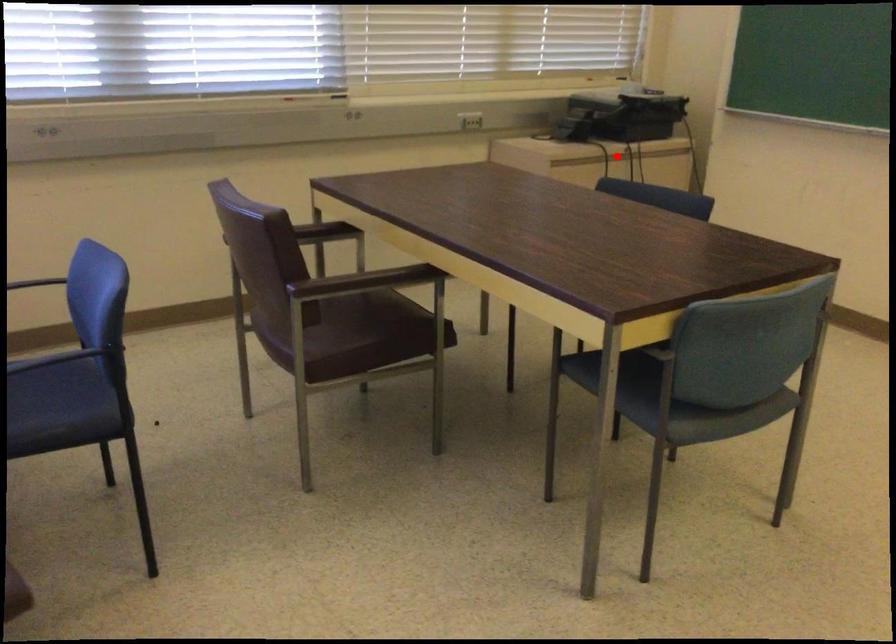
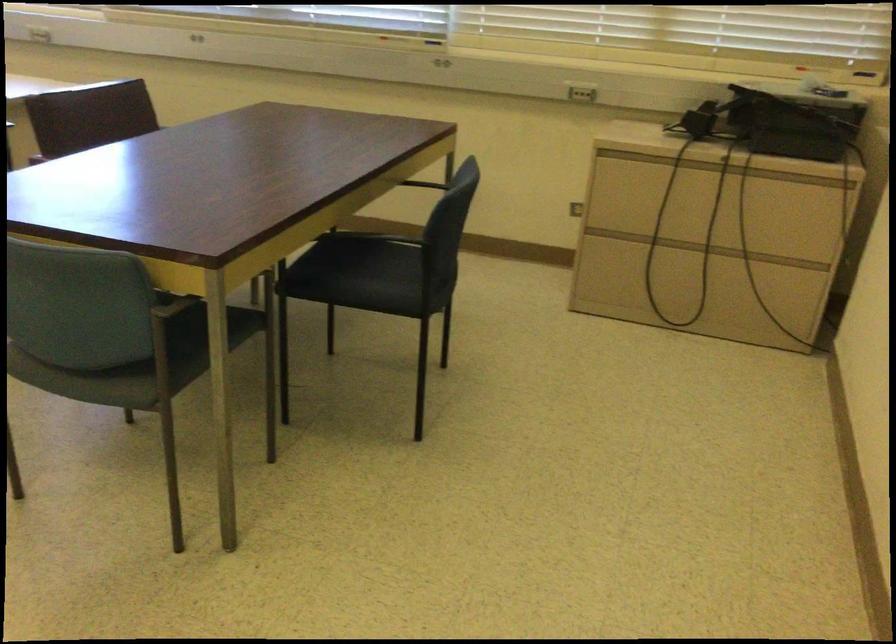
Question: I am providing you with two images of the same scene from different viewpoints. A red point is shown in image1. For the corresponding object point in image2, is it positioned nearer or farther from the camera?

Choices:
 (A) Nearer
 (B) Farther

Answer: (A)